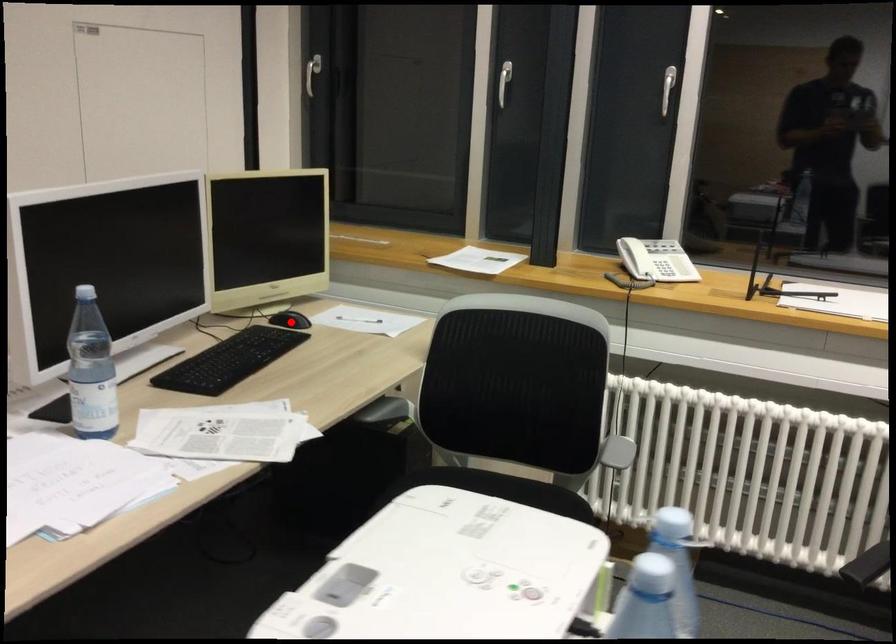
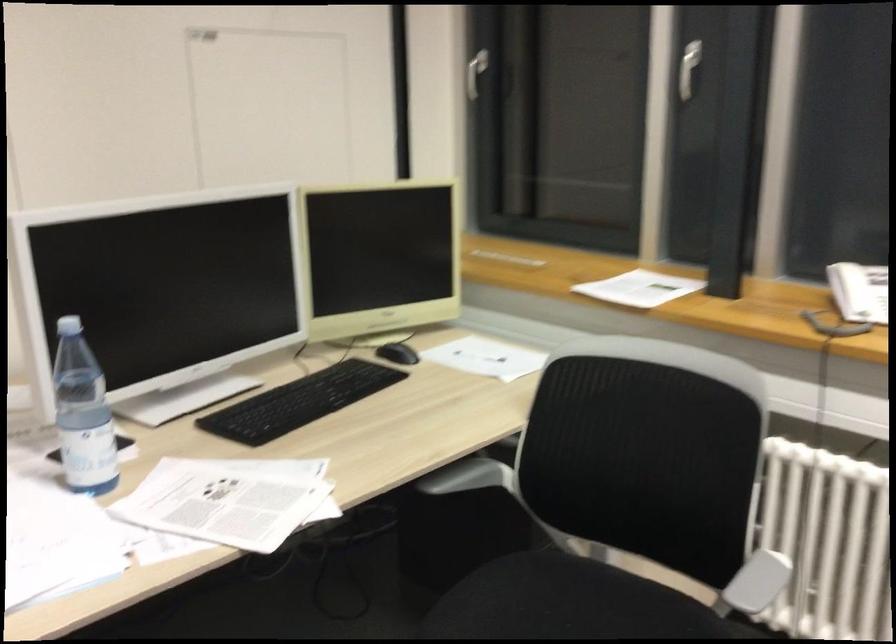
Question: I am providing you with two images of the same scene from different viewpoints. In image1, a red point is highlighted. Considering the same 3D point in image2, which of the following is correct?

Choices:
 (A) It is closer
 (B) It is farther

Answer: (A)